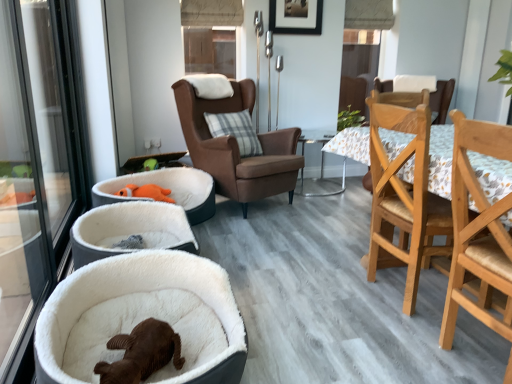
Question: Are green leafy plant at upper center and light wood/wooden dining chair at right, the 1th chair positioned from the front, located far from each other?

Choices:
 (A) yes
 (B) no

Answer: (A)

Question: Is green leafy plant at upper center looking in the opposite direction of light wood/wooden dining chair at right, the third chair viewed from the back?

Choices:
 (A) no
 (B) yes

Answer: (A)

Question: Considering the relative sizes of green leafy plant at upper center and light wood/wooden dining chair at right, the third chair viewed from the back, in the image provided, is green leafy plant at upper center taller than light wood/wooden dining chair at right, the third chair viewed from the back,?

Choices:
 (A) no
 (B) yes

Answer: (A)

Question: Is green leafy plant at upper center completely or partially outside of light wood/wooden dining chair at right, the third chair viewed from the back?

Choices:
 (A) no
 (B) yes

Answer: (B)

Question: Does green leafy plant at upper center have a smaller size compared to light wood/wooden dining chair at right, the 1th chair positioned from the front?

Choices:
 (A) yes
 (B) no

Answer: (A)

Question: Considering the relative sizes of green leafy plant at upper center and light wood/wooden dining chair at right, the 1th chair positioned from the front, in the image provided, is green leafy plant at upper center wider than light wood/wooden dining chair at right, the 1th chair positioned from the front,?

Choices:
 (A) yes
 (B) no

Answer: (B)

Question: From the image's perspective, is transparent glass window at upper center located above green leafy plant at upper center?

Choices:
 (A) no
 (B) yes

Answer: (B)

Question: Considering the relative sizes of transparent glass window at upper center and green leafy plant at upper center in the image provided, is transparent glass window at upper center wider than green leafy plant at upper center?

Choices:
 (A) yes
 (B) no

Answer: (B)

Question: Is green leafy plant at upper center a part of transparent glass window at upper center?

Choices:
 (A) no
 (B) yes

Answer: (A)

Question: From the image's perspective, is transparent glass window at upper center under green leafy plant at upper center?

Choices:
 (A) no
 (B) yes

Answer: (A)

Question: Is transparent glass window at upper center next to green leafy plant at upper center and touching it?

Choices:
 (A) no
 (B) yes

Answer: (A)

Question: Is transparent glass window at upper center further to the viewer compared to green leafy plant at upper center?

Choices:
 (A) no
 (B) yes

Answer: (A)

Question: From a real-world perspective, does green leafy plant at upper center stand above white plush dog bed at lower left?

Choices:
 (A) no
 (B) yes

Answer: (B)